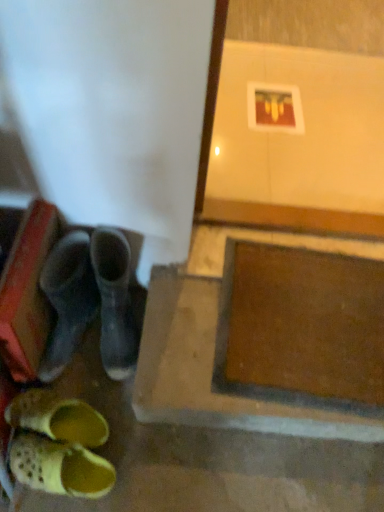
Question: Considering the positions of yellow mesh clog at lower left and brown matte concrete at lower right in the image, is yellow mesh clog at lower left taller or shorter than brown matte concrete at lower right?

Choices:
 (A) short
 (B) tall

Answer: (A)

Question: Is yellow mesh clog at lower left to the left or to the right of brown matte concrete at lower right in the image?

Choices:
 (A) right
 (B) left

Answer: (B)

Question: From a real-world perspective, is yellow mesh clog at lower left positioned above or below brown matte concrete at lower right?

Choices:
 (A) above
 (B) below

Answer: (B)

Question: Is brown matte concrete at lower right to the left or to the right of yellow mesh clog at lower left in the image?

Choices:
 (A) left
 (B) right

Answer: (B)

Question: Is brown matte concrete at lower right taller or shorter than yellow mesh clog at lower left?

Choices:
 (A) short
 (B) tall

Answer: (B)

Question: From the image's perspective, is brown matte concrete at lower right located above or below yellow mesh clog at lower left?

Choices:
 (A) above
 (B) below

Answer: (A)

Question: From a real-world perspective, is brown matte concrete at lower right above or below yellow mesh clog at lower left?

Choices:
 (A) below
 (B) above

Answer: (B)